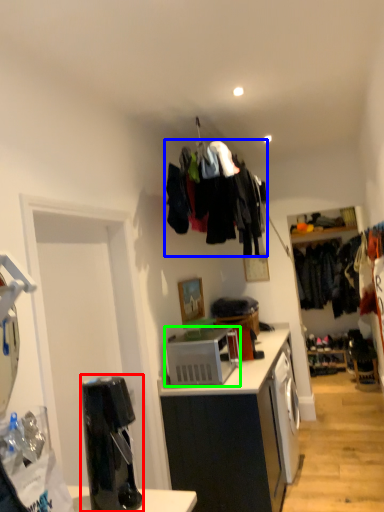
Question: Estimate the real-world distances between objects in this image. Which object is closer to coffee machine (highlighted by a red box), clothing (highlighted by a blue box) or microwave oven (highlighted by a green box)?

Choices:
 (A) clothing
 (B) microwave oven

Answer: (B)